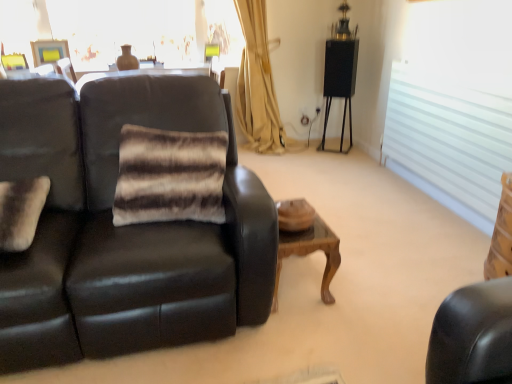
Question: Considering the positions of brown striped fur pillow at center, the 2th pillow from the left, and white frosted glass window at right, which ranks as the second window in left-to-right order, in the image, is brown striped fur pillow at center, the 2th pillow from the left, wider or thinner than white frosted glass window at right, which ranks as the second window in left-to-right order,?

Choices:
 (A) wide
 (B) thin

Answer: (A)

Question: Would you say brown striped fur pillow at center, arranged as the first pillow when viewed from the right, is to the left or to the right of white frosted glass window at right, the 1th window positioned from the right, in the picture?

Choices:
 (A) right
 (B) left

Answer: (B)

Question: Which object is positioned farthest from the translucent glass window at upper center, which is counted as the second window, starting from the front?

Choices:
 (A) matte black couch at left
 (B) white frosted glass window at right, which is the 1th window from bottom to top
 (C) woodenwoodentable at center
 (D) brown striped fur pillow at center, the 2th pillow from the left
 (E) fuzzy white pillow at left, which ranks as the second pillow in right-to-left order

Answer: (C)

Question: Which object is positioned farthest from the woodenwoodentable at center?

Choices:
 (A) fuzzy white pillow at left, which is the 1th pillow from left to right
 (B) matte black couch at left
 (C) translucent glass window at upper center, positioned as the 1th window in top-to-bottom order
 (D) brown striped fur pillow at center, arranged as the first pillow when viewed from the right
 (E) white frosted glass window at right, which ranks as the second window in left-to-right order

Answer: (C)